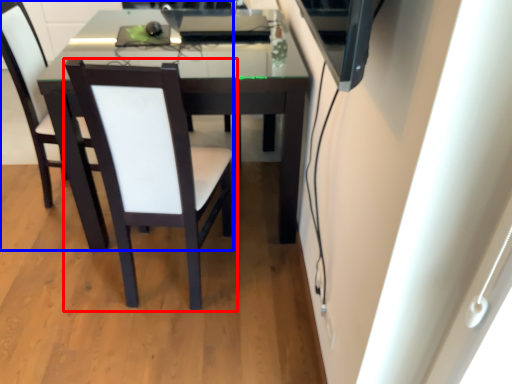
Question: Which of the following is the closest to the observer, chair (highlighted by a red box) or chair (highlighted by a blue box)?

Choices:
 (A) chair
 (B) chair

Answer: (A)